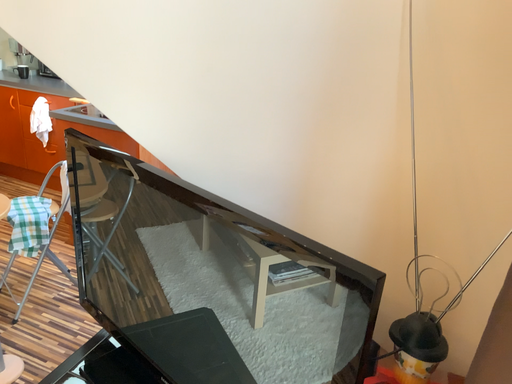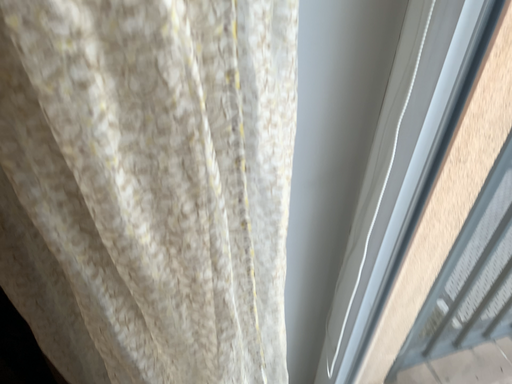
Question: How did the camera likely rotate when shooting the video?

Choices:
 (A) rotated left
 (B) rotated right

Answer: (B)